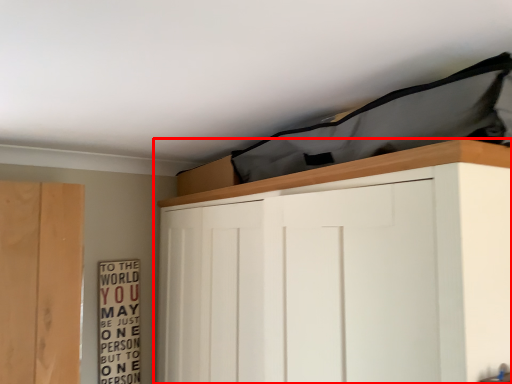
Question: From the image's perspective, considering the relative positions of cupboard (annotated by the red box) and bulletin board in the image provided, where is cupboard (annotated by the red box) located with respect to the staircase?

Choices:
 (A) above
 (B) below

Answer: (A)